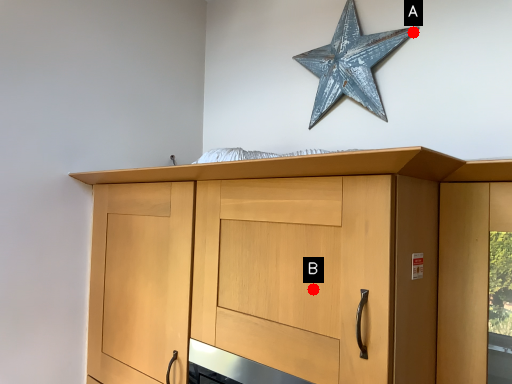
Question: Two points are circled on the image, labeled by A and B beside each circle. Which point appears closest to the camera in this image?

Choices:
 (A) A is closer
 (B) B is closer

Answer: (B)